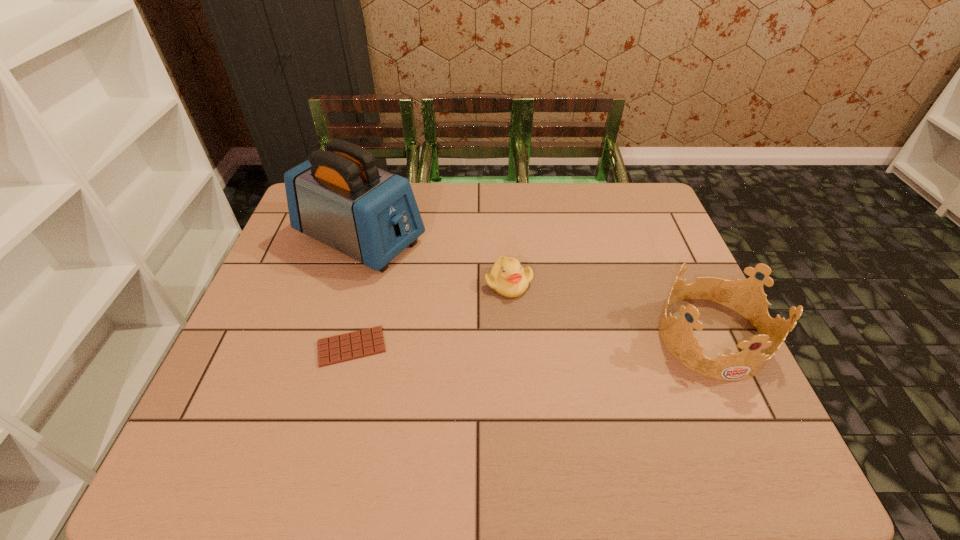
Identify the location of the shortest object. The height and width of the screenshot is (540, 960). (349, 346).

I want to click on the second tallest object, so tap(746, 297).

Locate an element on the screen. This screenshot has width=960, height=540. tiara is located at coordinates (746, 297).

Identify the location of the tallest object. (338, 196).

You are a GUI agent. You are given a task and a screenshot of the screen. Output one action in this format:
    pyautogui.click(x=<x>, y=<y>)
    Task: Click on the duckling
    
    Given the screenshot: What is the action you would take?
    pyautogui.click(x=508, y=278)

The height and width of the screenshot is (540, 960). I want to click on the second object from right to left, so click(x=508, y=278).

Where is `vacant space located 0.110m on the right of the shortest object`? The height and width of the screenshot is (540, 960). vacant space located 0.110m on the right of the shortest object is located at coordinates (434, 347).

What are the coordinates of `free space located 0.070m on the front-facing side of the rightmost object` in the screenshot? It's located at (745, 410).

The image size is (960, 540). Identify the location of vacant region located on the front-facing side of the tallest object. (500, 302).

I want to click on vacant space located on the front-facing side of the tallest object, so click(444, 275).